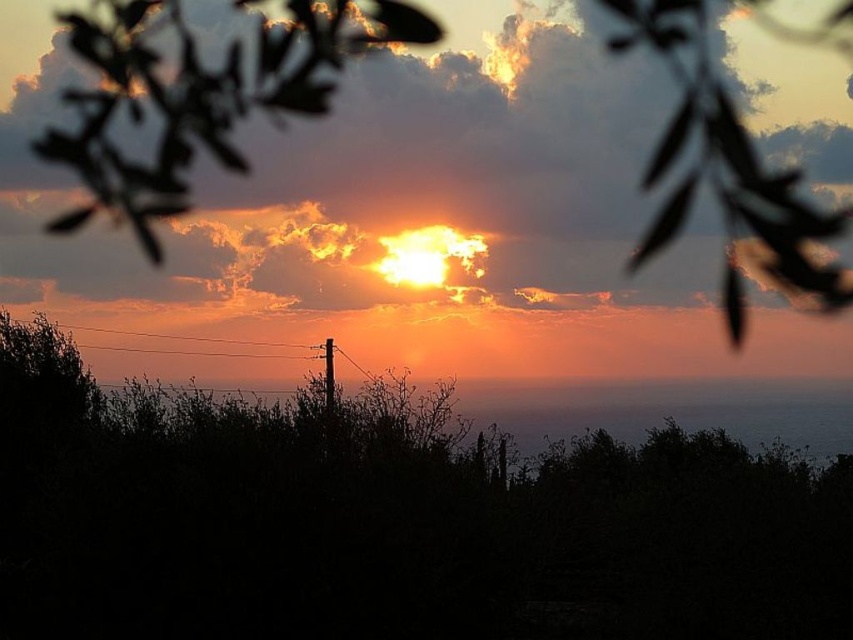
Question: Does silvery metallic leaves at upper left come behind smooth wooden telegraph pole at center?

Choices:
 (A) no
 (B) yes

Answer: (A)

Question: Which is farther from the cloudy sky at upper center?

Choices:
 (A) black wood telegraph pole at center
 (B) green leafy tree at center
 (C) smooth wooden telegraph pole at center

Answer: (C)

Question: Does cloudy sky at upper center appear on the left side of black wood telegraph pole at center?

Choices:
 (A) no
 (B) yes

Answer: (A)

Question: Which of the following is the farthest from the observer?

Choices:
 (A) (202, 108)
 (B) (323, 356)

Answer: (B)

Question: Is cloudy sky at upper center further to camera compared to silvery metallic leaves at upper left?

Choices:
 (A) yes
 (B) no

Answer: (A)

Question: Among these objects, which one is nearest to the camera?

Choices:
 (A) cloudy sky at upper center
 (B) silvery metallic leaves at upper left
 (C) black wood telegraph pole at center
 (D) smooth wooden telegraph pole at center

Answer: (B)